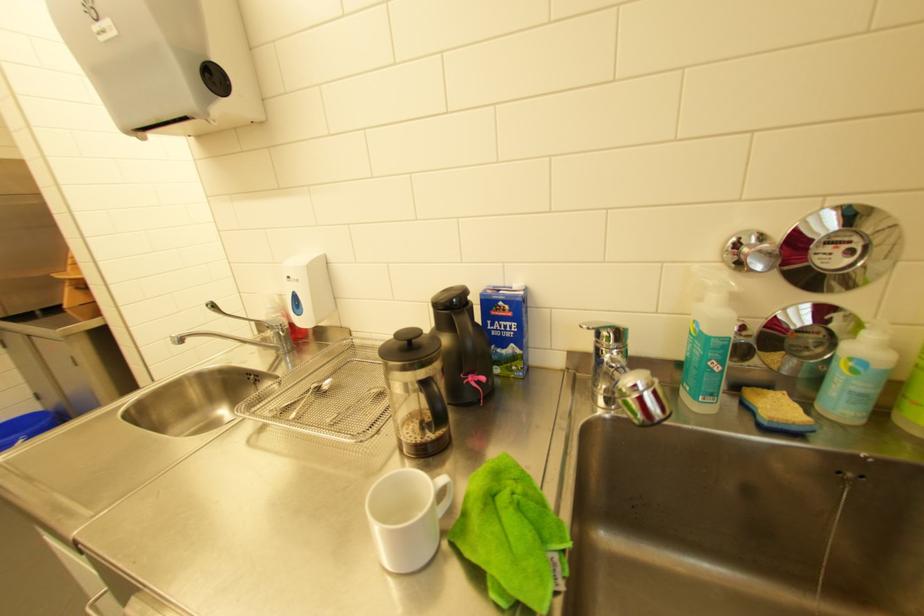
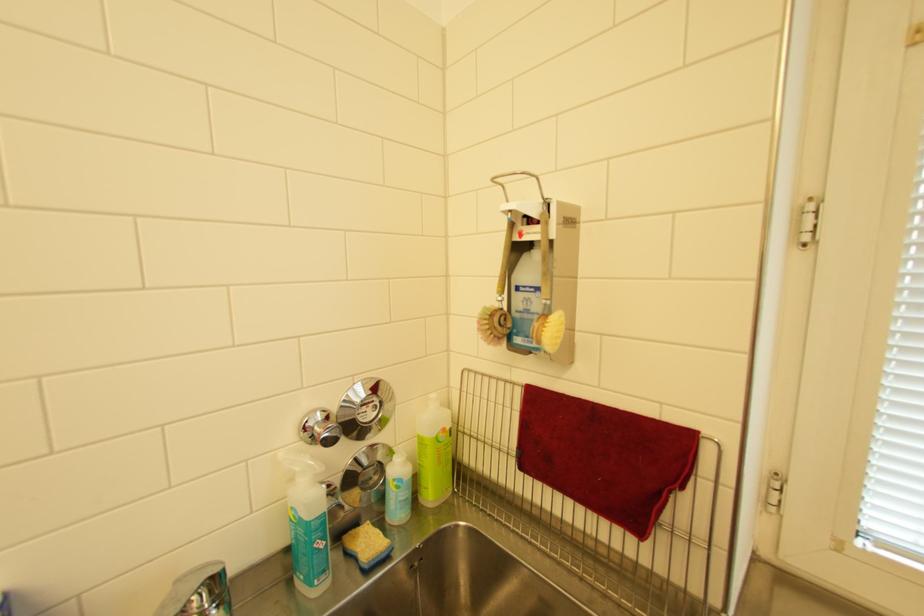
Question: Based on the continuous images, in which direction is the camera rotating? Reply with the corresponding letter.

Choices:
 (A) Left
 (B) Right
 (C) Up
 (D) Down

Answer: (B)